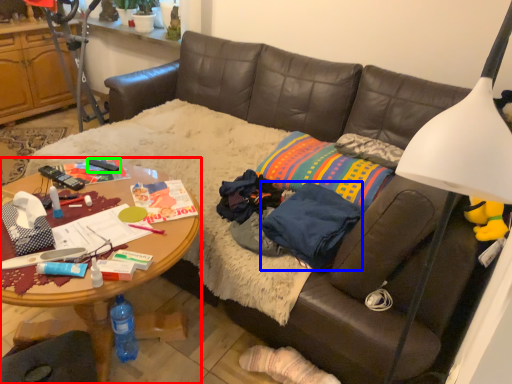
Question: Which is nearer to the desk (highlighted by a red box)? clothing (highlighted by a blue box) or remote control (highlighted by a green box).

Choices:
 (A) clothing
 (B) remote control

Answer: (B)